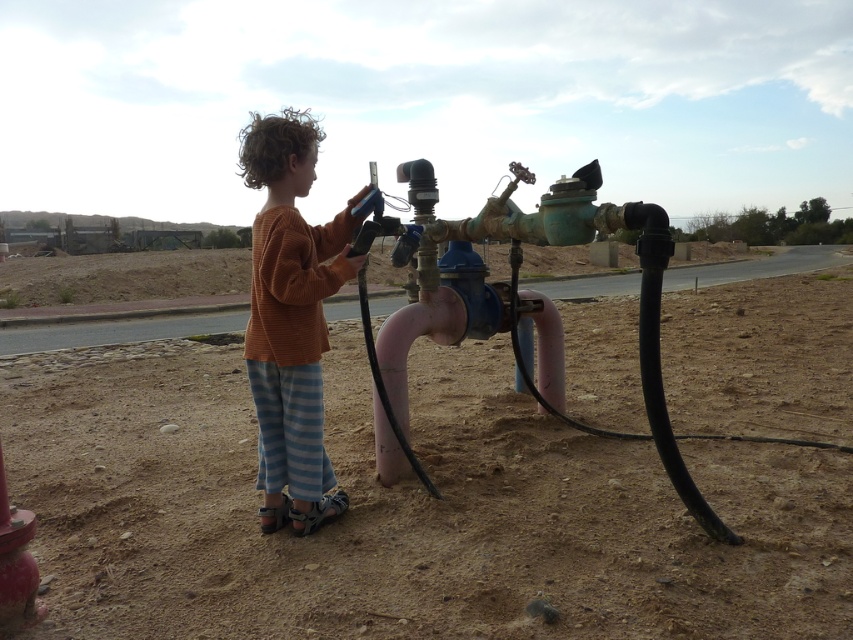
Question: Among these points, which one is nearest to the camera?

Choices:
 (A) (508, 292)
 (B) (291, 300)
 (C) (329, 358)

Answer: (B)

Question: Does greenish-brown metallic water pipe at center appear on the left side of matte red hydrant at lower left?

Choices:
 (A) no
 (B) yes

Answer: (A)

Question: Which point appears closest to the camera in this image?

Choices:
 (A) (15, 625)
 (B) (263, 243)

Answer: (A)

Question: Is dull brown dirt at center bigger than matte red hydrant at lower left?

Choices:
 (A) yes
 (B) no

Answer: (A)

Question: Which object is positioned farthest from the greenish-brown metallic water pipe at center?

Choices:
 (A) matte red hydrant at lower left
 (B) dull brown dirt at center
 (C) brown sweater at center

Answer: (A)

Question: Observing the image, what is the correct spatial positioning of greenish-brown metallic water pipe at center in reference to matte red hydrant at lower left?

Choices:
 (A) above
 (B) below

Answer: (A)